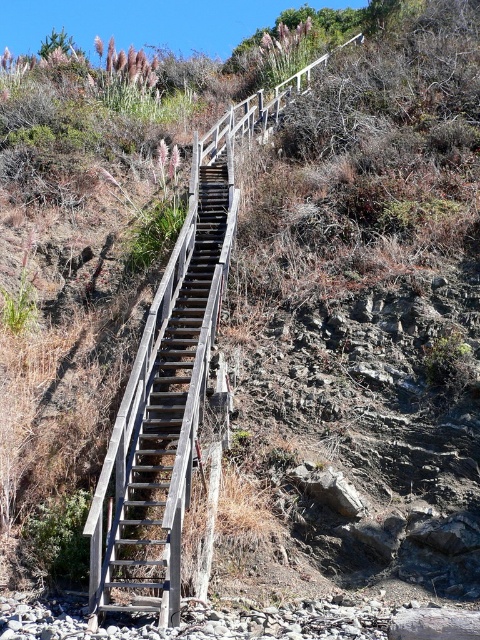
Can you confirm if wooden rail at upper center is taller than weathered wood stairs at center?

Yes, wooden rail at upper center is taller than weathered wood stairs at center.

Identify the location of wooden rail at upper center. The width and height of the screenshot is (480, 640). (171, 384).